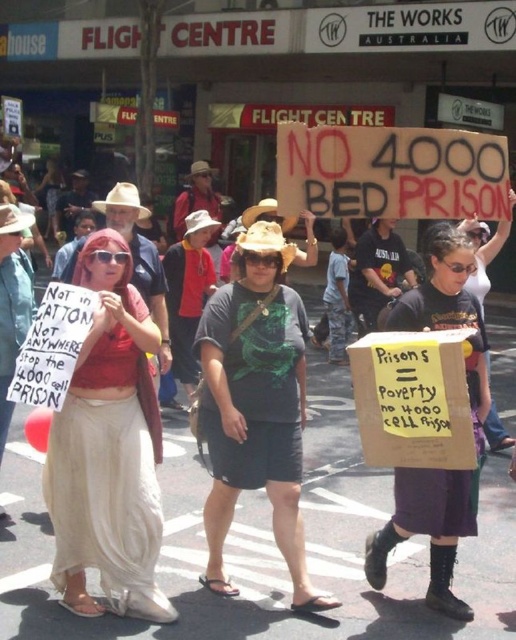
Question: Can you confirm if matte gray t-shirt at center is smaller than black cardboard sign at center?

Choices:
 (A) yes
 (B) no

Answer: (A)

Question: Does white cotton skirt at center appear on the left side of black cardboard sign at center?

Choices:
 (A) yes
 (B) no

Answer: (A)

Question: Which object is closer to the camera taking this photo?

Choices:
 (A) black cardboard sign at center
 (B) white cotton skirt at center
 (C) matte gray t-shirt at center

Answer: (A)

Question: Which point is closer to the camera?

Choices:
 (A) (440, 284)
 (B) (283, 400)

Answer: (A)

Question: Does white cotton skirt at center come in front of matte gray t-shirt at center?

Choices:
 (A) no
 (B) yes

Answer: (B)

Question: Which point is farther to the camera?

Choices:
 (A) white cotton skirt at center
 (B) black cardboard sign at center

Answer: (A)